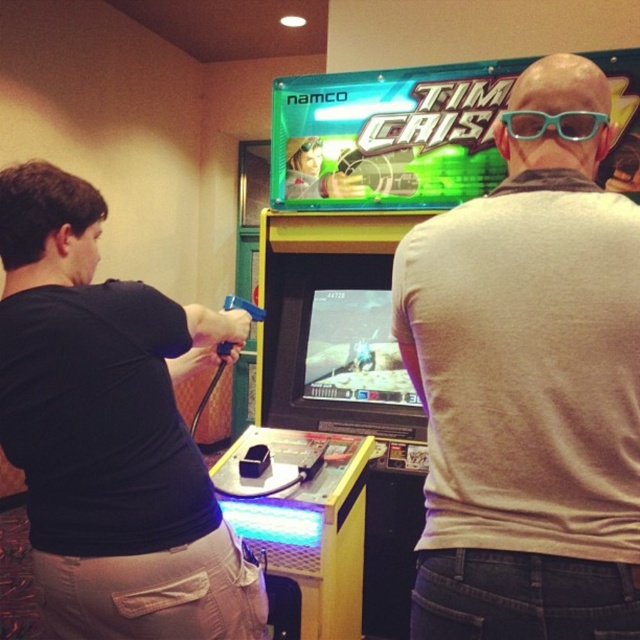
Question: Which of the following is the closest to the observer?

Choices:
 (A) (557, 124)
 (B) (637, 234)

Answer: (B)

Question: Which point is closer to the camera?

Choices:
 (A) (520, 81)
 (B) (560, 120)

Answer: (B)

Question: Considering the relative positions of gray matte shirt at center and teal plastic glasses at upper center in the image provided, where is gray matte shirt at center located with respect to teal plastic glasses at upper center?

Choices:
 (A) above
 (B) below

Answer: (B)

Question: Is gray matte shirt at center positioned at the back of teal plastic glasses at upper center?

Choices:
 (A) no
 (B) yes

Answer: (A)

Question: Which point is closer to the camera?

Choices:
 (A) (513, 125)
 (B) (589, 180)

Answer: (B)

Question: Does gray matte shirt at center appear on the right side of teal plastic glasses at upper center?

Choices:
 (A) yes
 (B) no

Answer: (B)